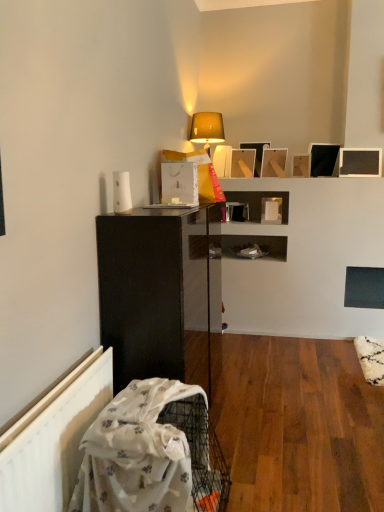
Find the location of a particular element. Image resolution: width=384 pixels, height=512 pixels. blank space situated above white plastic radiator at lower left (from a real-world perspective) is located at coordinates (63, 380).